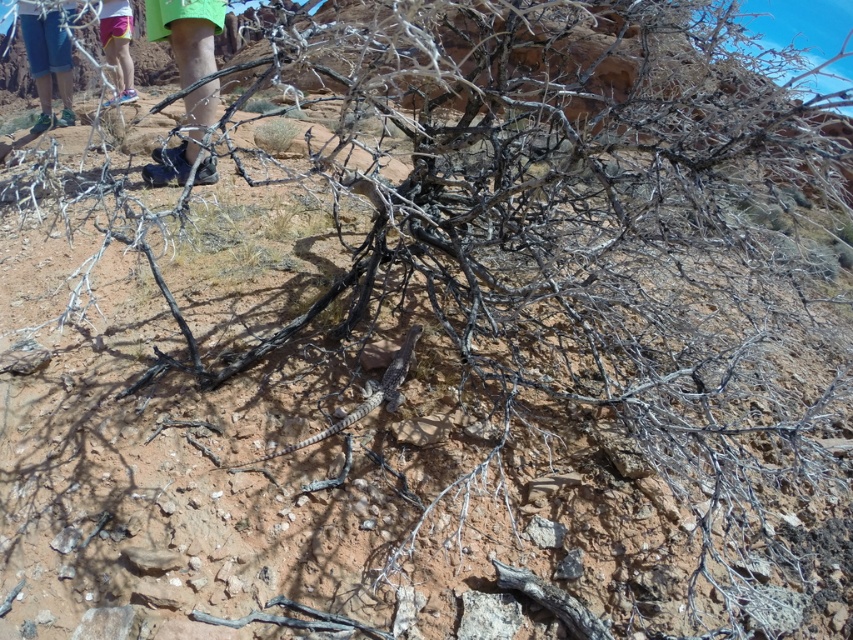
Does point (38, 88) come farther from viewer compared to point (122, 13)?

Yes, it is behind point (122, 13).

Does blue denim shorts at upper left appear under pink fabric shorts at upper left?

Indeed, blue denim shorts at upper left is positioned under pink fabric shorts at upper left.

Who is more distant from viewer, (44, 92) or (103, 8)?

The point (44, 92) is behind.

The width and height of the screenshot is (853, 640). In order to click on blue denim shorts at upper left in this screenshot , I will do `click(48, 58)`.

Which of these two, black leather shoe at upper left or blue denim shorts at upper left, stands taller?

black leather shoe at upper left

Which is above, black leather shoe at upper left or blue denim shorts at upper left?

blue denim shorts at upper left

Between point (187, 65) and point (24, 45), which one is positioned behind?

Positioned behind is point (24, 45).

Where is `black leather shoe at upper left`? This screenshot has width=853, height=640. black leather shoe at upper left is located at coordinates (186, 33).

Is black leather shoe at upper left bigger than pink fabric shorts at upper left?

Correct, black leather shoe at upper left is larger in size than pink fabric shorts at upper left.

Does black leather shoe at upper left appear over pink fabric shorts at upper left?

Incorrect, black leather shoe at upper left is not positioned above pink fabric shorts at upper left.

Does point (157, 38) come in front of point (105, 10)?

Yes.

Find the location of a particular element. This screenshot has width=853, height=640. black leather shoe at upper left is located at coordinates (186, 33).